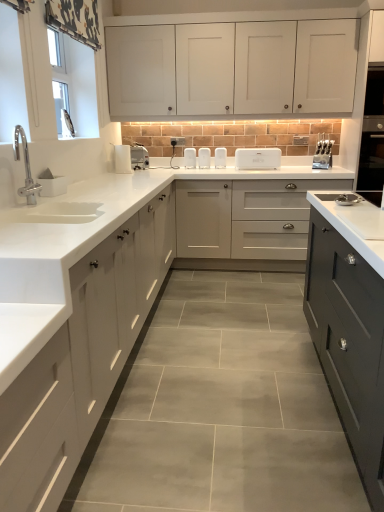
Question: Relative to white matte cabinet at left, arranged as the third cabinetry when viewed from the top, is white glossy countertop at center in front or behind?

Choices:
 (A) front
 (B) behind

Answer: (A)

Question: Looking at their shapes, would you say white glossy countertop at center is wider or thinner than white matte cabinet at left, arranged as the first cabinetry when ordered from the bottom?

Choices:
 (A) thin
 (B) wide

Answer: (B)

Question: Estimate the real-world distances between objects in this image. Which object is closer to the white plastic toaster at center, acting as the 2th appliance starting from the back?

Choices:
 (A) white plastic toaster at center, marked as the seventh appliance in a left-to-right arrangement
 (B) white glossy toaster at center, placed as the 8th appliance when sorted from front to back
 (C) white matte soap dish at left, acting as the eighth appliance starting from the right
 (D) white matte cabinet at upper center, which is the third cabinetry in bottom-to-top order
 (E) white glossy countertop at center

Answer: (B)

Question: Which is nearer to the white matte soap dish at left, which appears as the 8th appliance when viewed from the back?

Choices:
 (A) white plastic toaster at center, the 2th appliance in the right-to-left sequence
 (B) white glossy toaster at center, marked as the 4th appliance in a left-to-right arrangement
 (C) matte gray cabinet at center, the 2th cabinetry positioned from the top
 (D) white plastic toaster at center, which is counted as the 4th appliance, starting from the right
 (E) white plastic toaster at upper center, which is the 7th appliance in right-to-left order

Answer: (E)